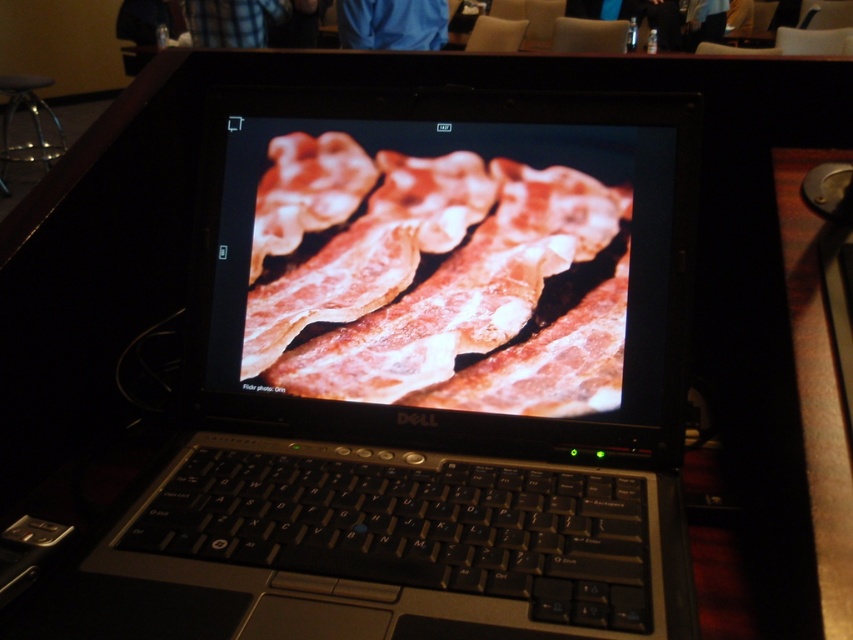
I want to click on satin black laptop at center, so click(x=426, y=378).

Is point (415, 284) closer to camera compared to point (425, 356)?

No, (415, 284) is further to viewer.

Does point (340, 545) come in front of point (486, 252)?

Yes, it is.

The width and height of the screenshot is (853, 640). I want to click on satin black laptop at center, so click(x=426, y=378).